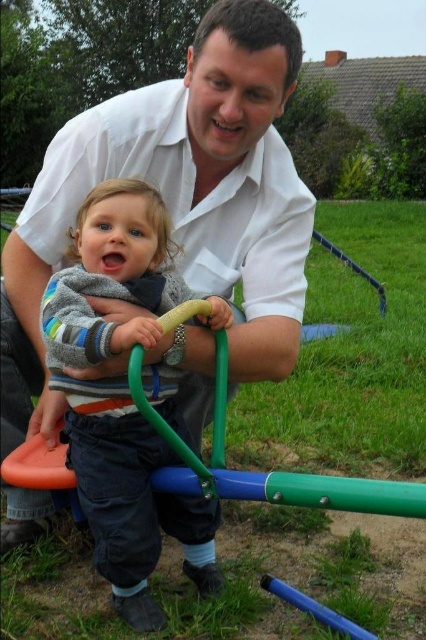
Looking at this image, you are a photographer trying to capture the scene of the man and child on the seesaw. You need to ensure that both the white smooth shirt at upper center and the green plastic bar at center are visible in your shot. Given their widths, which object should you focus on to ensure both are in frame without cropping?

Since the white smooth shirt at upper center has a lesser width compared to the green plastic bar at center, you should focus on the green plastic bar at center as it is wider, ensuring both objects remain in frame without cropping.

You are standing at the point labeled as point [86,256] and want to walk to the point labeled as point [296,324]. Which direction should you move relative to your current position?

You should move backward because point [296,324] is behind point [86,256] relative to your current position.